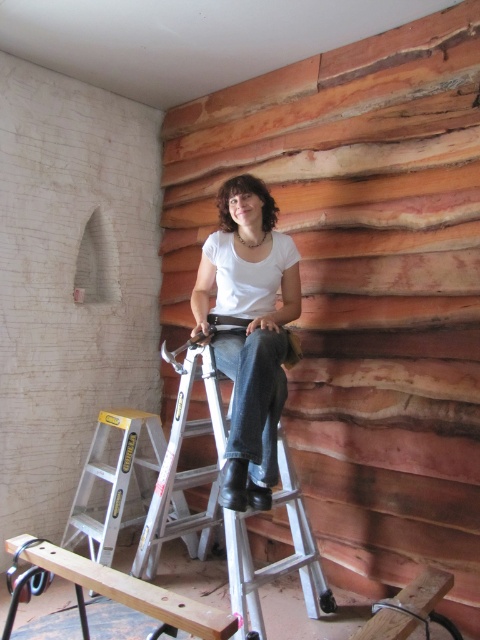
You are standing at the origin point in the room. The silver metallic ladder at center is located at coordinates 0.795, 0.471. If you want to move towards the ladder, in which direction should you move?

The silver metallic ladder at center is located at coordinates (226, 508), so you should move towards the ladder in the direction of increasing x and y coordinates.

You are an interior designer evaluating the space in the image. You need to hang a decorative item that requires a hook. The hook must be placed above the wooden plank at lower center but must not interfere with the matte white shirt at center. Given their sizes, is this placement feasible?

The matte white shirt at center has a larger size compared to wooden plank at lower center. Since the shirt is larger, placing the hook above the wooden plank at lower center may be possible if the shirt is not directly in front of the plank. However, the exact feasibility depends on the vertical positioning and the distance between the shirt and the wall.

You are a construction worker in the room. You need to move from the silver metallic ladder at lower left to the silver metallic ladder at center. Which direction should you move to reach it?

The silver metallic ladder at center is to the right of the silver metallic ladder at lower left, so you should move to the right to reach it.